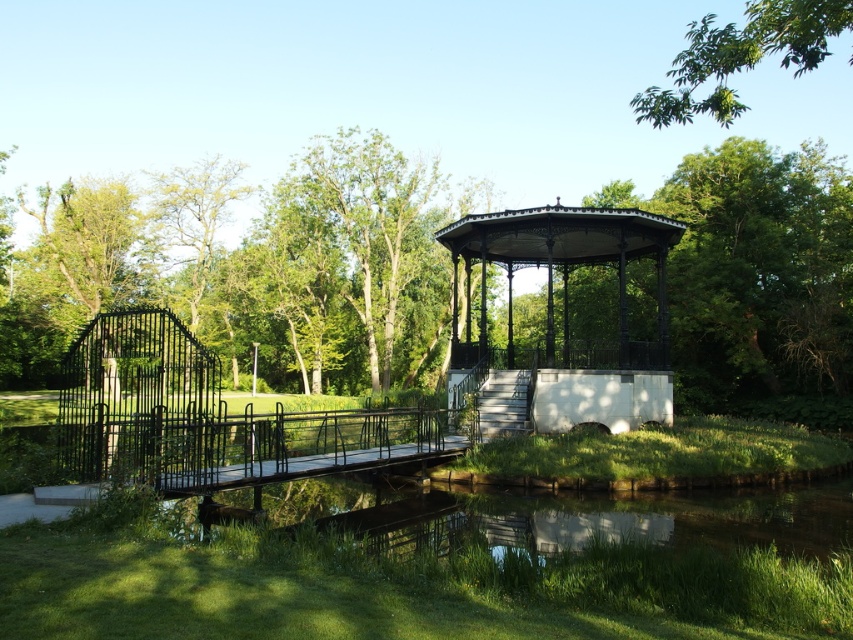
Does black wrought iron gazebo at center have a lesser height compared to green leafy tree at left?

Yes.

Is point (592, 250) farther from camera compared to point (77, 192)?

No, it is in front of (77, 192).

What are the coordinates of `black wrought iron gazebo at center` in the screenshot? It's located at (566, 321).

From the picture: Who is positioned more to the left, black wrought iron gazebo at center or green leafy tree at upper right?

From the viewer's perspective, black wrought iron gazebo at center appears more on the left side.

Identify the location of black wrought iron gazebo at center. (566, 321).

Does point (492, 241) lie behind point (730, 72)?

Yes, point (492, 241) is behind point (730, 72).

Locate an element on the screen. Image resolution: width=853 pixels, height=640 pixels. black wrought iron gazebo at center is located at coordinates (566, 321).

This screenshot has width=853, height=640. Describe the element at coordinates (360, 257) in the screenshot. I see `green leafy tree at upper center` at that location.

Is point (338, 184) in front of point (750, 67)?

No, (338, 184) is behind (750, 67).

What are the coordinates of `green leafy tree at upper center` in the screenshot? It's located at (x=360, y=257).